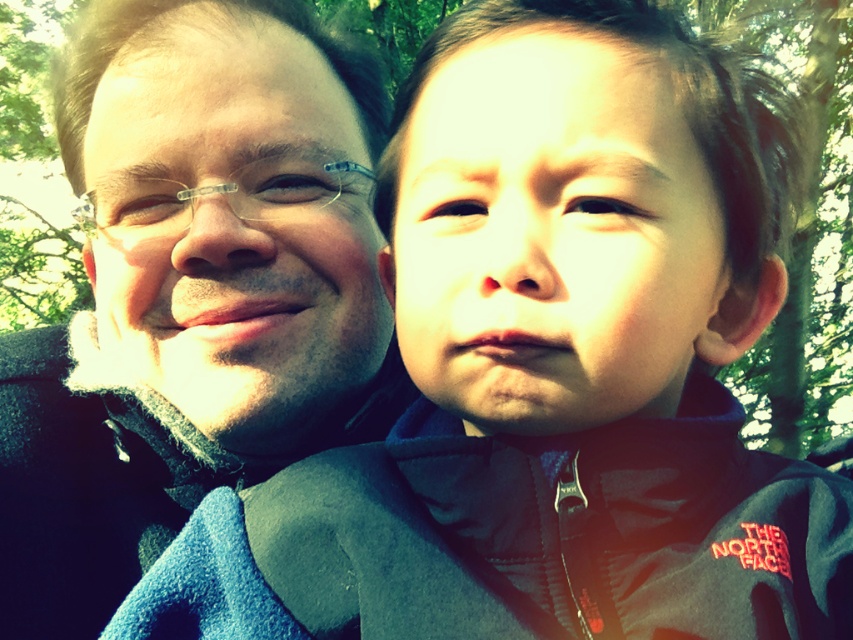
You are a photographer adjusting the focus on your camera. The camera has a depth of field that can clearly capture objects within 8 inches. You need to focus on both the smooth skin face at center and the matte black glasses at left. Will both be in focus?

The distance between the smooth skin face at center and matte black glasses at left is 8.11 inches. Since the depth of field can only clearly capture objects within 8 inches, the two objects are just slightly beyond the depth of field range. Therefore, both may not be in perfect focus simultaneously.

Looking at the scene, where is the dark gray fleece jacket at right in relation to the matte black glasses at left?

The dark gray fleece jacket at right is to the right of the matte black glasses at left.